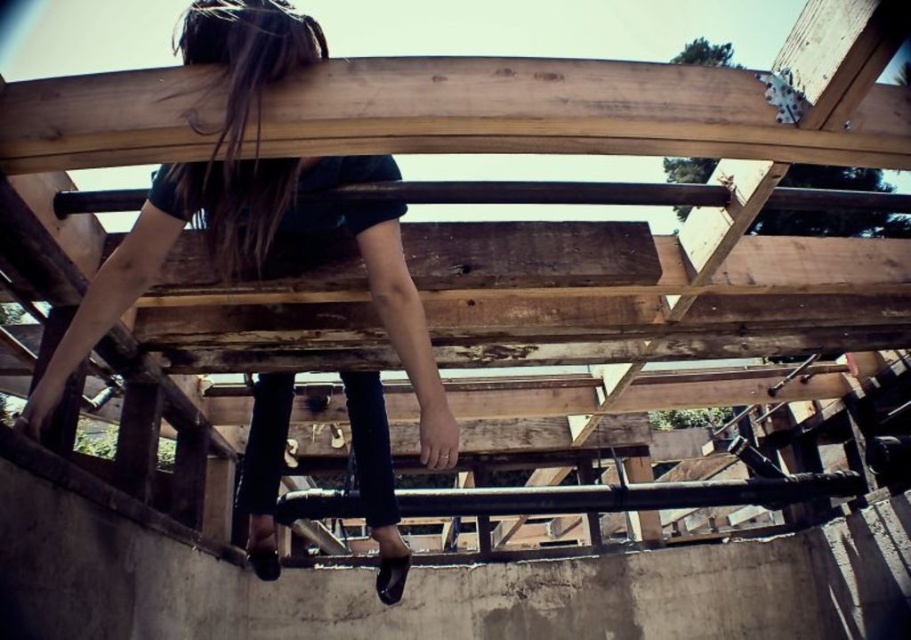
Question: Which point is farther to the camera?

Choices:
 (A) (211, 243)
 (B) (374, 156)

Answer: (A)

Question: Can you confirm if matte black hair at upper center is thinner than brown/dry hair at upper center?

Choices:
 (A) yes
 (B) no

Answer: (B)

Question: Is matte black hair at upper center in front of brown/dry hair at upper center?

Choices:
 (A) no
 (B) yes

Answer: (A)

Question: Which of the following is the farthest from the observer?

Choices:
 (A) (318, 214)
 (B) (189, 52)

Answer: (A)

Question: Among these points, which one is nearest to the camera?

Choices:
 (A) (202, 225)
 (B) (265, 81)

Answer: (B)

Question: Observing the image, what is the correct spatial positioning of matte black hair at upper center in reference to brown/dry hair at upper center?

Choices:
 (A) right
 (B) left

Answer: (A)